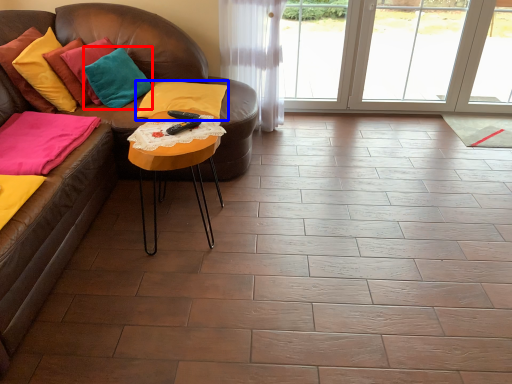
Question: Which object is further to the camera taking this photo, pillow (highlighted by a red box) or pillow (highlighted by a blue box)?

Choices:
 (A) pillow
 (B) pillow

Answer: (B)